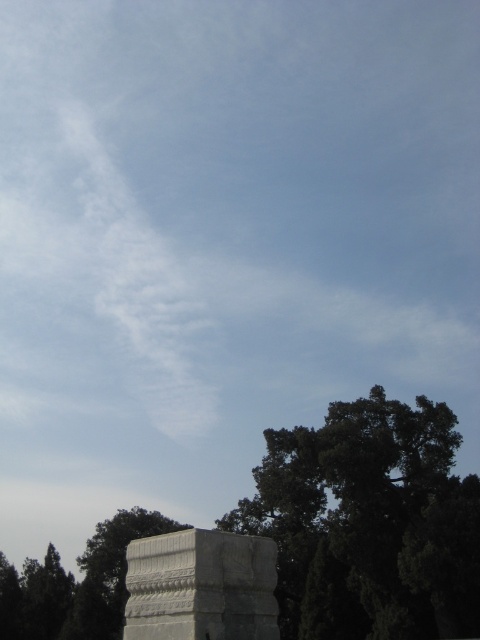
You are standing in the middle of the scene and want to walk towards the white stone monument at lower center. There is a green leafy tree at lower right blocking your path. Can you walk around the tree to reach the monument?

The green leafy tree at lower right is wider than the white stone monument at lower center, so you can walk around the tree on either side to reach the monument.

You are a photographer planning to capture the white stone monument at lower center and the green leafy tree at lower left in the same frame. Based on their sizes, which object would appear narrower in the photo?

The white stone monument at lower center appears narrower in the photo since it is thinner than the green leafy tree at lower left.

You are standing in front of the white stone monument at lower center and want to take a photo of the green leafy tree at lower right. Which direction should you turn to face the tree?

The green leafy tree at lower right is positioned under the white stone monument at lower center, so you should turn to your right to face the tree.